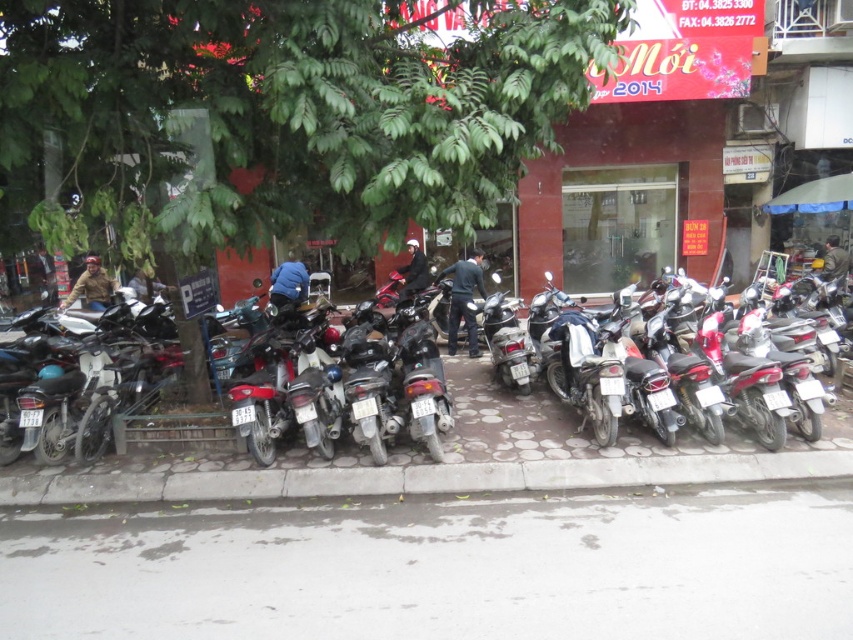
Which of these two, gray concrete curb at lower center or matte brown helmet at left, stands shorter?

Standing shorter between the two is gray concrete curb at lower center.

How much distance is there between gray concrete curb at lower center and matte brown helmet at left?

gray concrete curb at lower center is 8.71 meters from matte brown helmet at left.

Measure the distance between gray concrete curb at lower center and camera.

gray concrete curb at lower center is 6.01 meters away from camera.

Identify the location of gray concrete curb at lower center. The height and width of the screenshot is (640, 853). (421, 477).

At what (x,y) coordinates should I click in order to perform the action: click on green leafy tree at center. Please return your answer as a coordinate pair (x, y). Image resolution: width=853 pixels, height=640 pixels. Looking at the image, I should click on (282, 115).

Image resolution: width=853 pixels, height=640 pixels. Find the location of `green leafy tree at center`. green leafy tree at center is located at coordinates (282, 115).

Identify the location of green leafy tree at center. (282, 115).

Can you confirm if gray concrete curb at lower center is shorter than metallic silver motorcycle at center?

No, gray concrete curb at lower center is not shorter than metallic silver motorcycle at center.

Between point (65, 476) and point (834, 417), which one is positioned in front?

Point (65, 476) is in front.

Locate an element on the screen. This screenshot has height=640, width=853. gray concrete curb at lower center is located at coordinates (421, 477).